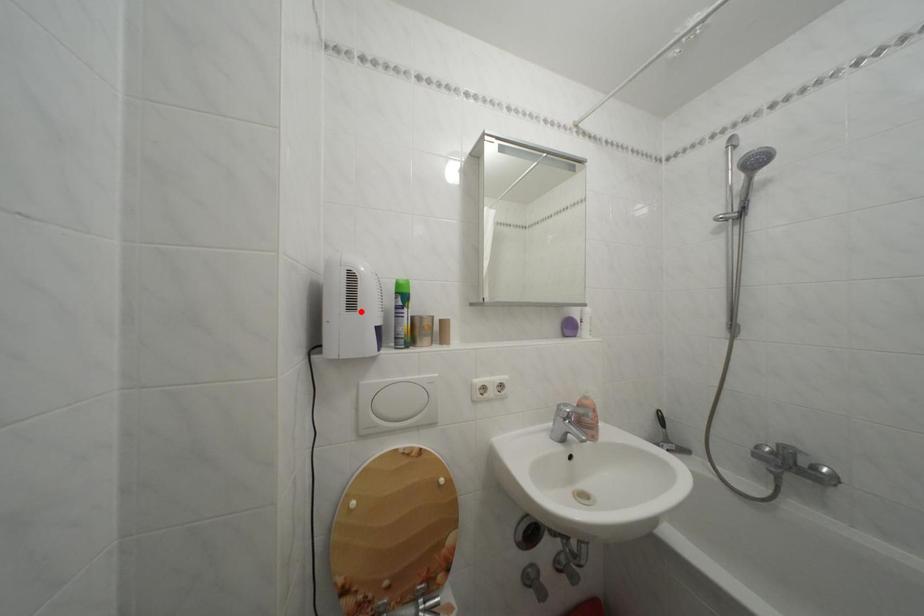
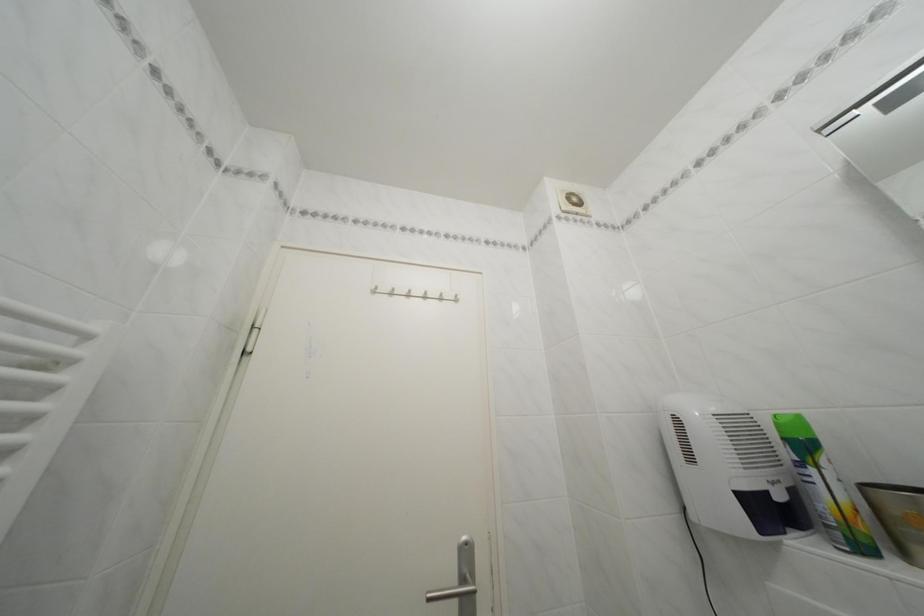
Find the pixel in the second image that matches the highlighted location in the first image.

(699, 464)